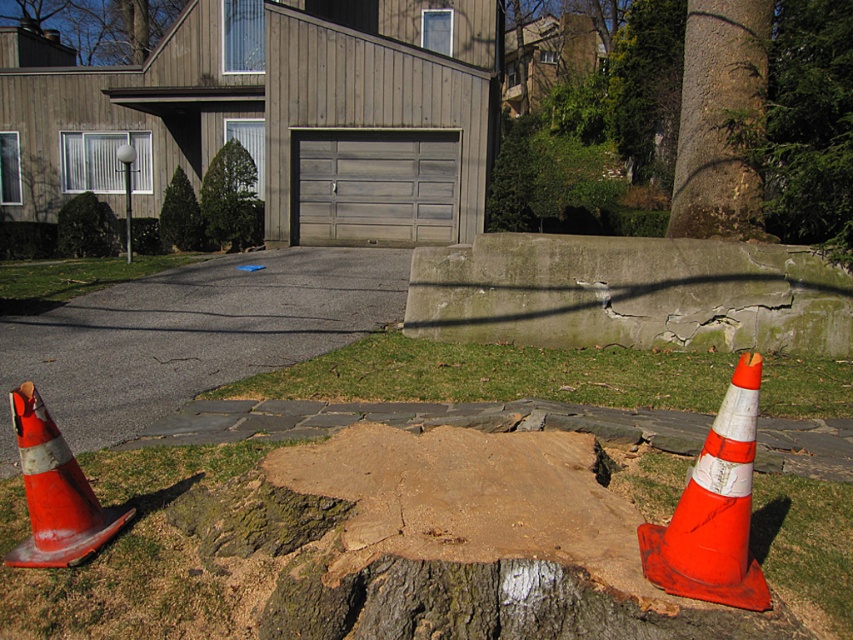
You are standing at the entrance of the house and want to walk to the green textured evergreen tree at upper left. Which direction should you turn to avoid stepping on the asphalt at lower left?

The asphalt at lower left is to the right of the green textured evergreen tree at upper left, so you should turn left to reach the tree without stepping on the asphalt.